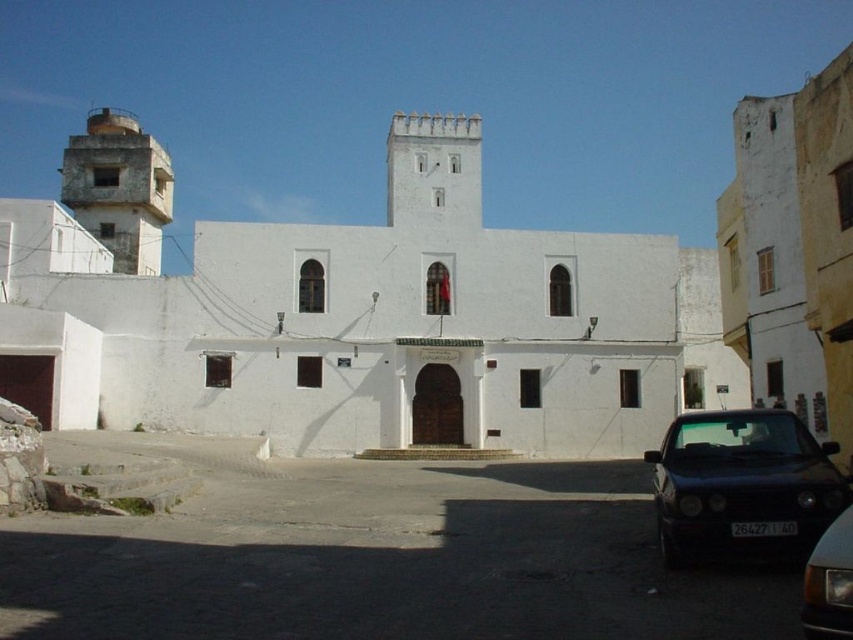
You are a photographer planning to take a photo of the traditional white building with its entrance and architectural details. You have two objects in the scene, the black glossy car at lower right and the concrete tower at upper left. Which object should you position closer to the camera to ensure the building remains the main focus?

The black glossy car at lower right should be positioned closer to the camera because it is shorter than the concrete tower at upper left. This way, the car won t block the view of the building s entrance and architectural details, keeping the building as the main focus.

You are standing in front of the building and want to determine the relative positions of two points marked on the structure. The first point is at coordinate point(773, 500) and the second is at point(125, 259). Which point is closer to your current position?

Point(773, 500) is closer to the viewer than point(125, 259).